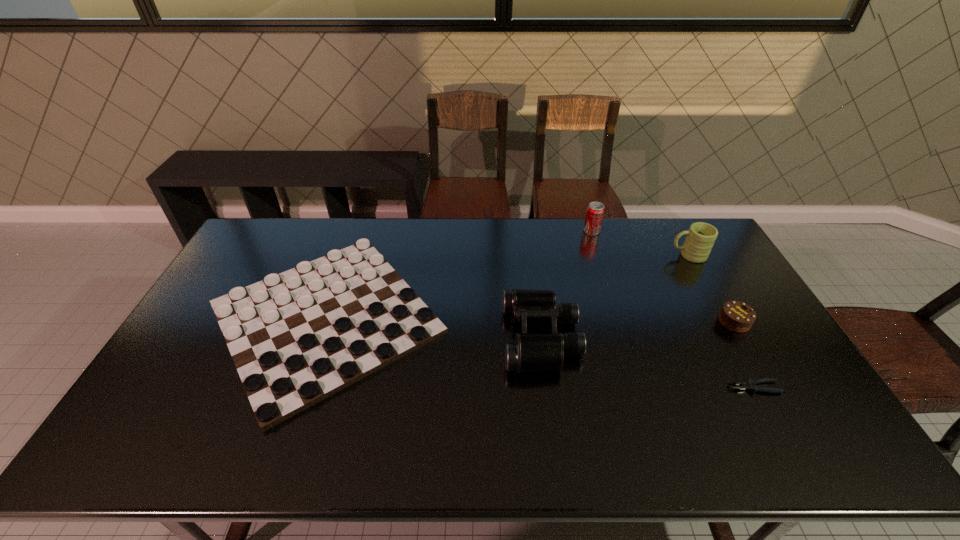
At what (x,y) coordinates should I click in order to perform the action: click on vacant space positioned on the side of the mug with the handle. Please return your answer as a coordinate pair (x, y). This screenshot has width=960, height=540. Looking at the image, I should click on (560, 255).

Where is `vacant space situated on the side of the mug with the handle`? vacant space situated on the side of the mug with the handle is located at coordinates (577, 255).

The height and width of the screenshot is (540, 960). Identify the location of free space located 0.220m on the front-facing side of the binoculars. (429, 337).

The height and width of the screenshot is (540, 960). What are the coordinates of `free space located 0.320m on the front-facing side of the binoculars` in the screenshot? It's located at (395, 337).

You are a GUI agent. You are given a task and a screenshot of the screen. Output one action in this format:
    pyautogui.click(x=<x>, y=<y>)
    Task: Click on the vacant space located 0.110m on the front-facing side of the binoculars
    
    Given the screenshot: What is the action you would take?
    pyautogui.click(x=467, y=337)

At what (x,y) coordinates should I click in order to perform the action: click on vacant space situated 0.180m on the front of the fourth tallest object. Please return your answer as a coordinate pair (x, y). Looking at the image, I should click on (770, 385).

Image resolution: width=960 pixels, height=540 pixels. Find the location of `vacant space situated on the back of the second shortest object`. vacant space situated on the back of the second shortest object is located at coordinates (360, 222).

The image size is (960, 540). I want to click on vacant space positioned 0.200m at the gripping part of the pliers, so click(x=652, y=387).

Find the location of `vacant space located at the gripping part of the pliers`. vacant space located at the gripping part of the pliers is located at coordinates (576, 387).

What are the coordinates of `vacant space located at the gripping part of the pliers` in the screenshot? It's located at (648, 387).